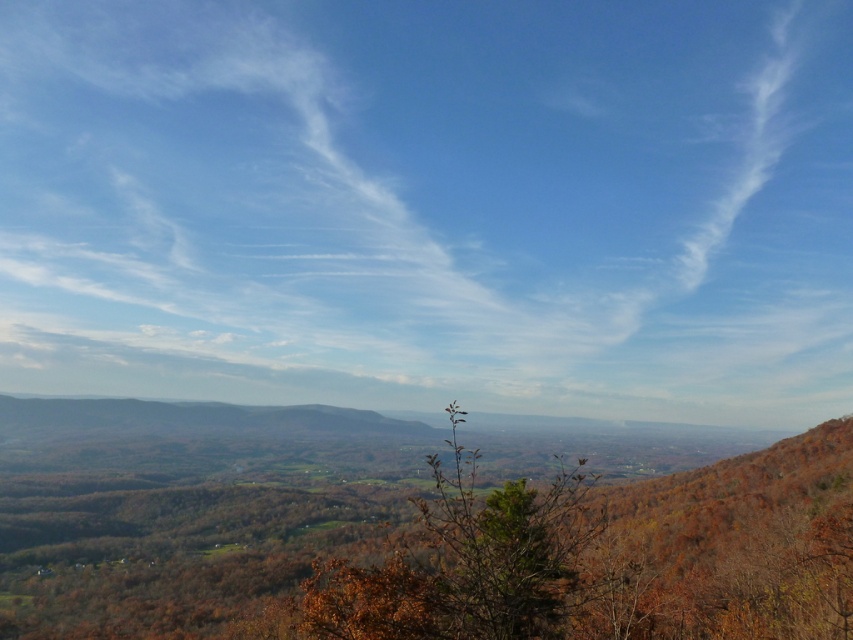
Question: Is white cotton cloud at upper center in front of brown leafy tree at center?

Choices:
 (A) no
 (B) yes

Answer: (A)

Question: Does white cotton cloud at upper center appear over brown leafy tree at center?

Choices:
 (A) no
 (B) yes

Answer: (B)

Question: Which point appears farthest from the camera in this image?

Choices:
 (A) (445, 72)
 (B) (401, 435)

Answer: (A)

Question: Does white cotton cloud at upper center have a greater width compared to brown leafy tree at center?

Choices:
 (A) yes
 (B) no

Answer: (A)

Question: Which of the following is the closest to the observer?

Choices:
 (A) (184, 108)
 (B) (820, 586)

Answer: (B)